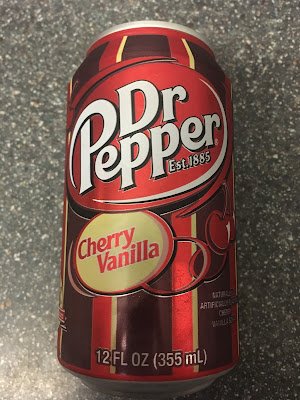
Find the location of a particular element. The width and height of the screenshot is (300, 400). dark gray marble counter top is located at coordinates (35, 107), (265, 117).